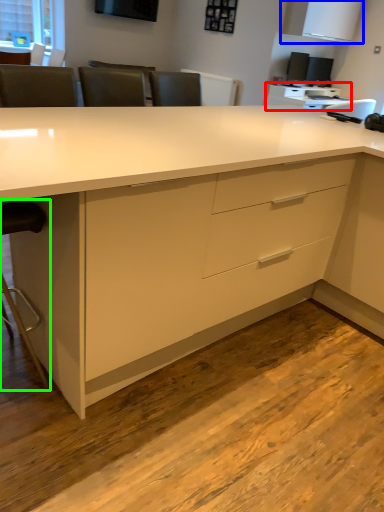
Question: Which object is positioned farthest from computer desk (highlighted by a red box)? Select from cabinetry (highlighted by a blue box) and swivel chair (highlighted by a green box).

Choices:
 (A) cabinetry
 (B) swivel chair

Answer: (B)